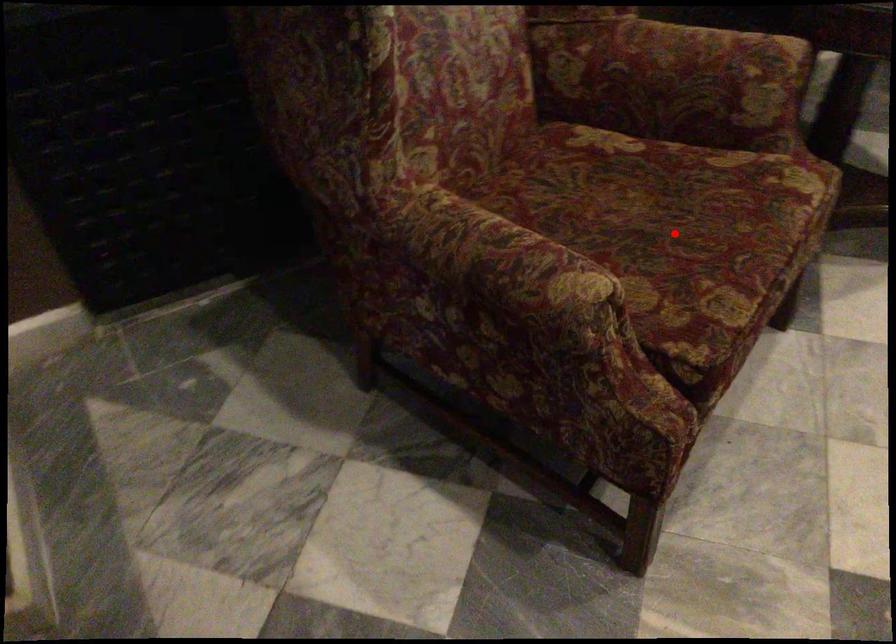
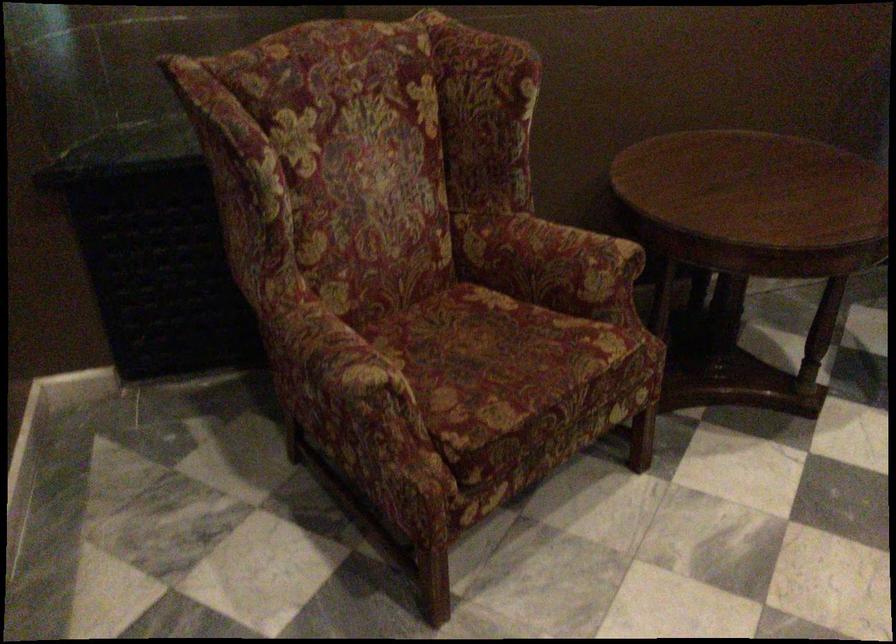
In the second image, find the point that corresponds to the highlighted location in the first image.

(495, 363)